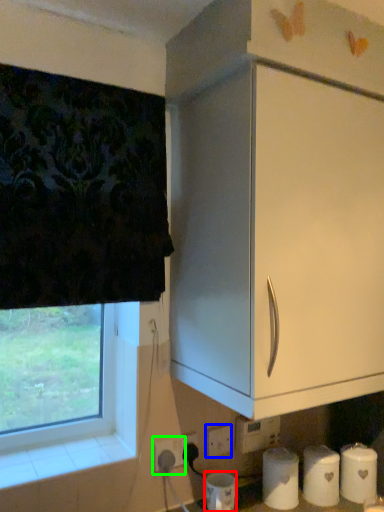
Question: Which is farther away from paper towel (highlighted by a red box)? electric outlet (highlighted by a blue box) or electric outlet (highlighted by a green box)?

Choices:
 (A) electric outlet
 (B) electric outlet

Answer: (B)